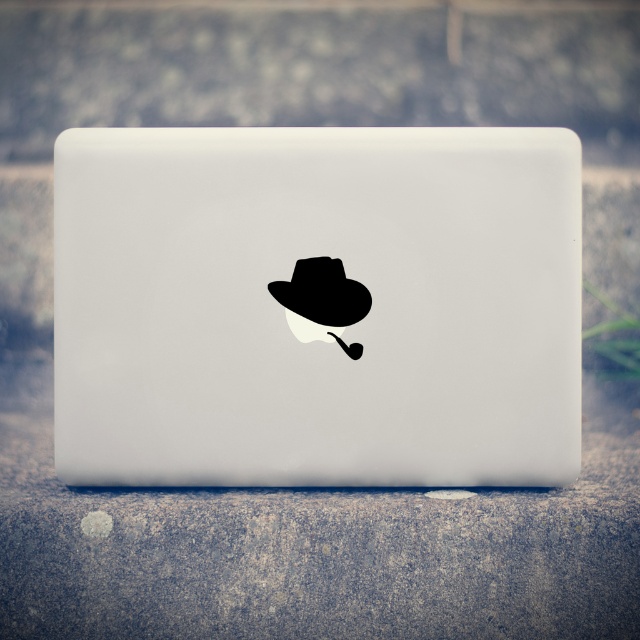
Which is more to the left, white matte laptop at center or black matte fedora at center?

From the viewer's perspective, white matte laptop at center appears more on the left side.

Is white matte laptop at center to the right of black matte fedora at center from the viewer's perspective?

No, white matte laptop at center is not to the right of black matte fedora at center.

This screenshot has width=640, height=640. Find the location of `white matte laptop at center`. white matte laptop at center is located at coordinates (312, 321).